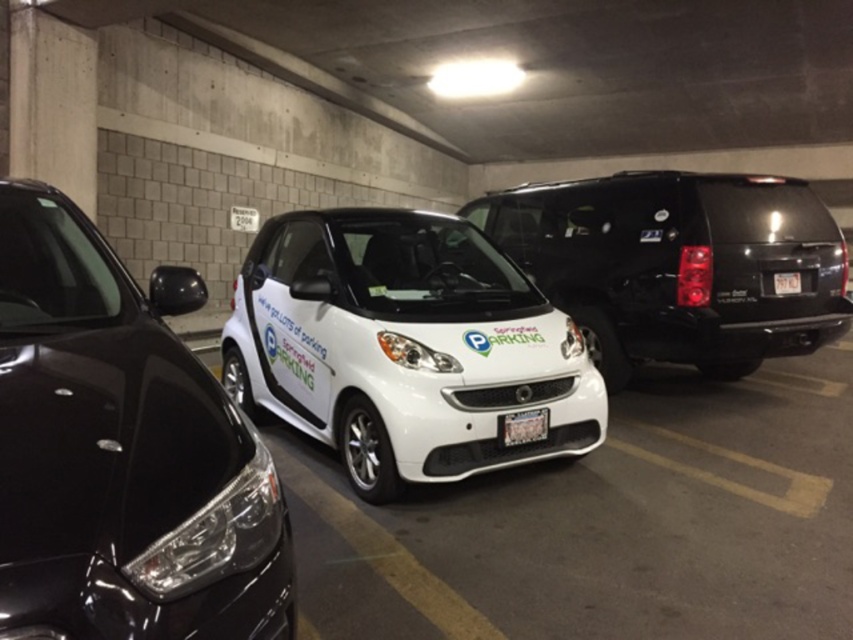
Question: Can you confirm if white glossy smart car at center is wider than white plastic license plate at center?

Choices:
 (A) no
 (B) yes

Answer: (B)

Question: Is the position of glossy black suv at left less distant than that of metallic silver license plate at center?

Choices:
 (A) no
 (B) yes

Answer: (B)

Question: Can you confirm if white glossy smart car at center is positioned below white plastic license plate at center?

Choices:
 (A) no
 (B) yes

Answer: (B)

Question: Which is nearer to the shiny black minivan at center?

Choices:
 (A) white glossy smart car at center
 (B) white plastic license plate at center
 (C) metallic silver license plate at center

Answer: (B)

Question: Which object appears closest to the camera in this image?

Choices:
 (A) white plastic license plate at center
 (B) metallic silver license plate at center
 (C) white glossy smart car at center
 (D) shiny black minivan at center

Answer: (C)

Question: Considering the real-world distances, which object is closest to the white glossy smart car at center?

Choices:
 (A) glossy black suv at left
 (B) shiny black minivan at center

Answer: (A)